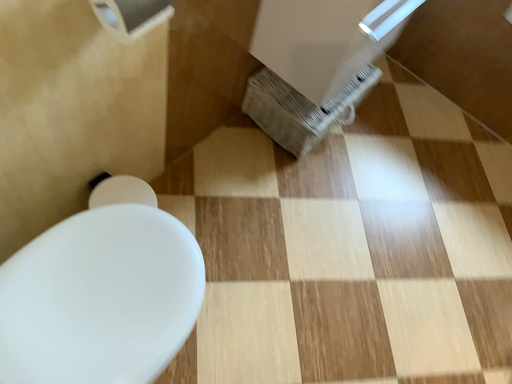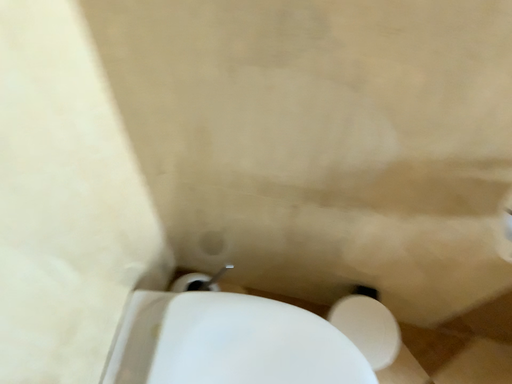
Question: Which way did the camera rotate in the video?

Choices:
 (A) rotated upward
 (B) rotated downward

Answer: (A)